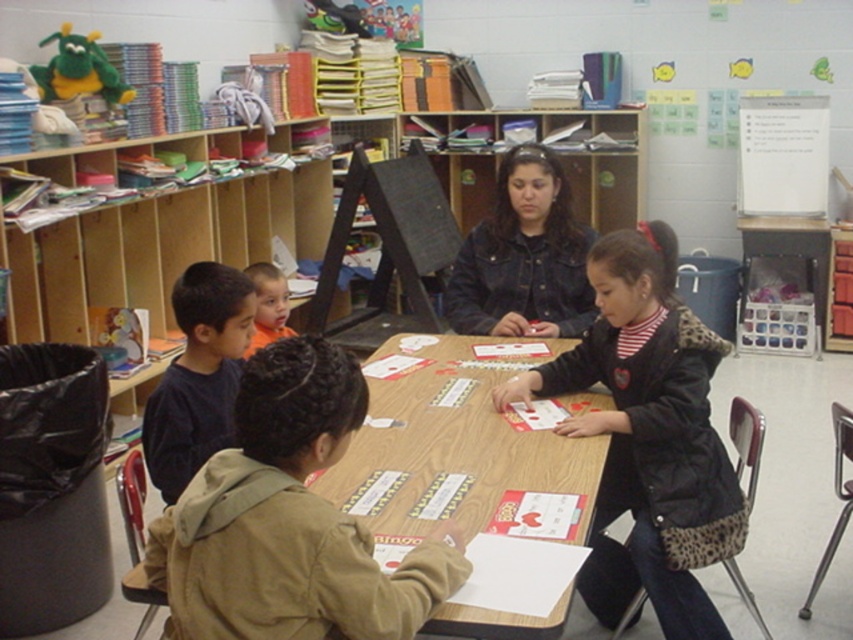
You are a student in the classroom and you need to retrieve both the khaki fleece jacket at center and the denim jacket at center from the table. Which jacket should you remove first to access the other?

The khaki fleece jacket at center is positioned under the denim jacket at center, so you should remove the denim jacket at center first to access the khaki fleece jacket at center.